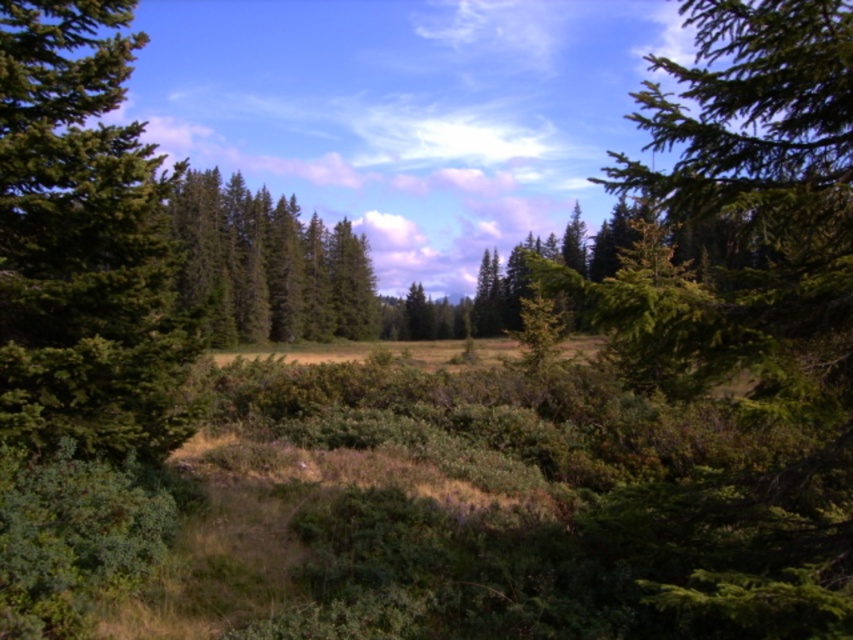
You are standing in the forest and want to walk towards the green matte tree at center. Which direction should you move relative to the green matte tree at left?

You should move to the right of the green matte tree at left to reach the green matte tree at center since the green matte tree at left is closer to you, indicating it is in front of the center tree.

You are a hiker who wants to take a photo of the green matte tree at left and the green matte tree at center from a position where both are visible. Based on their sizes in the image, which tree should you position closer to the camera to ensure both are fully in the frame?

The green matte tree at left is smaller than the green matte tree at center. To ensure both are fully visible, position the smaller green matte tree at left closer to the camera so its size in the frame matches the larger green matte tree at center.

You are standing at the center of the forest clearing. You notice a green matte tree at left. Where is the green matte tree located relative to your position?

The green matte tree at left is located at point 0.383 on the horizontal axis and 0.100 on the vertical axis relative to your position at the center of the clearing.